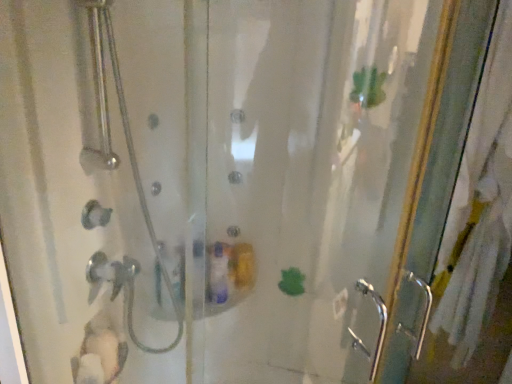
This screenshot has height=384, width=512. What do you see at coordinates (462, 221) in the screenshot?
I see `clear glass screen door at right` at bounding box center [462, 221].

Identify the location of clear glass screen door at right. (462, 221).

Find the location of a particular element. This screenshot has width=512, height=384. clear glass shower door at left is located at coordinates (95, 186).

Describe the element at coordinates (95, 186) in the screenshot. I see `clear glass shower door at left` at that location.

What is the approximate width of clear glass shower door at left?

clear glass shower door at left is 7.54 inches in width.

What is the approximate height of clear glass shower door at left?

16.56 inches.

Identify the location of clear glass screen door at right. This screenshot has width=512, height=384. (462, 221).

Considering the relative positions of clear glass screen door at right and clear glass shower door at left in the image provided, is clear glass screen door at right to the left of clear glass shower door at left from the viewer's perspective?

No.

Is clear glass screen door at right further to the viewer compared to clear glass shower door at left?

That is True.

Does point (464, 224) appear closer or farther from the camera than point (159, 197)?

Point (464, 224).

From the image's perspective, would you say clear glass screen door at right is shown under clear glass shower door at left?

Indeed, from the image's perspective, clear glass screen door at right is shown beneath clear glass shower door at left.

From a real-world perspective, between clear glass screen door at right and clear glass shower door at left, who is vertically higher?

clear glass shower door at left, from a real-world perspective.

Looking at their sizes, would you say clear glass screen door at right is wider or thinner than clear glass shower door at left?

Considering their sizes, clear glass screen door at right looks broader than clear glass shower door at left.

From their relative heights in the image, would you say clear glass screen door at right is taller or shorter than clear glass shower door at left?

clear glass screen door at right is taller than clear glass shower door at left.

Considering the relative sizes of clear glass screen door at right and clear glass shower door at left in the image provided, is clear glass screen door at right bigger than clear glass shower door at left?

Correct, clear glass screen door at right is larger in size than clear glass shower door at left.

Is clear glass shower door at left surrounded by clear glass screen door at right?

No, clear glass shower door at left is located outside of clear glass screen door at right.

Does clear glass screen door at right touch clear glass shower door at left?

No, clear glass screen door at right is not beside clear glass shower door at left.

Is clear glass screen door at right oriented towards clear glass shower door at left?

No, clear glass screen door at right is not facing towards clear glass shower door at left.

What's the angular difference between clear glass screen door at right and clear glass shower door at left's facing directions?

The angle between the facing direction of clear glass screen door at right and the facing direction of clear glass shower door at left is 84.9 degrees.

The width and height of the screenshot is (512, 384). Identify the location of screen door that appears on the right of clear glass shower door at left. (462, 221).

Which object is positioned more to the left, clear glass shower door at left or clear glass screen door at right?

Positioned to the left is clear glass shower door at left.

Does clear glass shower door at left lie behind clear glass screen door at right?

No.

Is point (139, 189) positioned behind point (443, 106)?

No, it is in front of (443, 106).

From the image's perspective, which object appears higher, clear glass shower door at left or clear glass screen door at right?

From the image's view, clear glass shower door at left is above.

From a real-world perspective, which is physically below, clear glass shower door at left or clear glass screen door at right?

clear glass screen door at right.

Is clear glass shower door at left wider than clear glass screen door at right?

In fact, clear glass shower door at left might be narrower than clear glass screen door at right.

Which of these two, clear glass shower door at left or clear glass screen door at right, stands shorter?

With less height is clear glass shower door at left.

Can you confirm if clear glass shower door at left is smaller than clear glass screen door at right?

Indeed, clear glass shower door at left has a smaller size compared to clear glass screen door at right.

Is clear glass shower door at left inside or outside of clear glass screen door at right?

The correct answer is: outside.

Are clear glass shower door at left and clear glass screen door at right making contact?

No, clear glass shower door at left is not beside clear glass screen door at right.

Is clear glass screen door at right at the back of clear glass shower door at left?

No.

How far apart are clear glass shower door at left and clear glass screen door at right?

clear glass shower door at left is 98.09 centimeters away from clear glass screen door at right.

At what (x,y) coordinates should I click in order to perform the action: click on shower door on the left of clear glass screen door at right. Please return your answer as a coordinate pair (x, y). Looking at the image, I should click on (95, 186).

This screenshot has height=384, width=512. I want to click on shower door that is in front of the clear glass screen door at right, so click(x=95, y=186).

The height and width of the screenshot is (384, 512). I want to click on shower door on the left of clear glass screen door at right, so click(x=95, y=186).